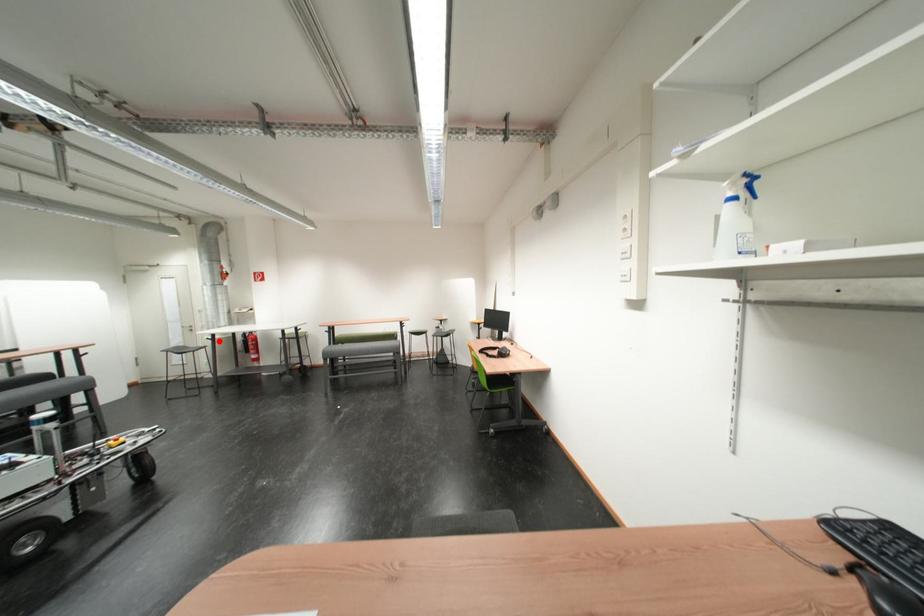
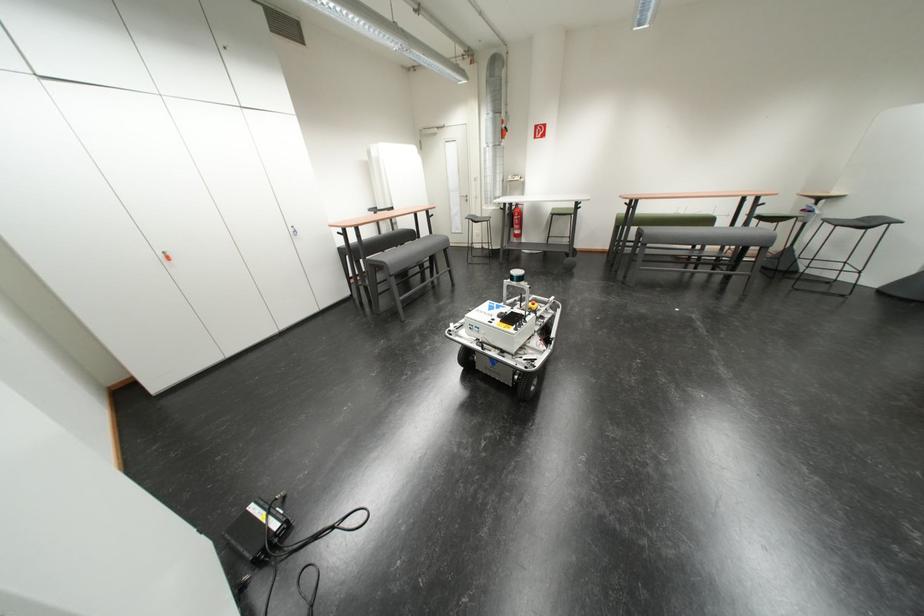
Locate, in the second image, the point that corresponds to the highlighted location in the first image.

(512, 211)